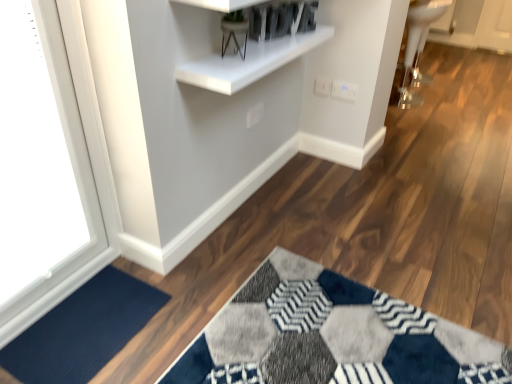
Question: From a real-world perspective, relative to white glossy shelf at upper center, is white plastic electric outlet at upper right, which is the 1th electric outlet in left-to-right order, vertically above or below?

Choices:
 (A) above
 (B) below

Answer: (B)

Question: Is white plastic electric outlet at upper right, which is the 1th electric outlet in left-to-right order, to the left or to the right of white glossy shelf at upper center in the image?

Choices:
 (A) left
 (B) right

Answer: (B)

Question: Based on their relative distances, which object is nearer to the white glossy sink at upper right?

Choices:
 (A) white glossy window at upper left
 (B) white glossy shelf at upper center
 (C) navy blue carpet at lower left
 (D) white plastic electric outlet at upper right, the second electric outlet in the right-to-left sequence
 (E) white plastic electric outlet at upper center, the first electric outlet from the right

Answer: (E)

Question: Which object is the farthest from the white glossy sink at upper right?

Choices:
 (A) white glossy window at upper left
 (B) navy blue carpet at lower left
 (C) white glossy shelf at upper center
 (D) white plastic electric outlet at upper center, the 2th electric outlet when ordered from left to right
 (E) white plastic electric outlet at upper right, which is the 1th electric outlet in left-to-right order

Answer: (B)